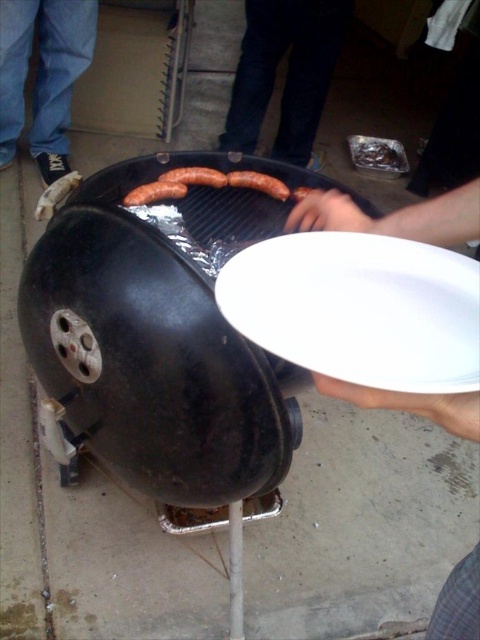
You are standing in front of the grill and want to reach two points marked in the scene. The first point is at coordinate point(38,202) and the second is at point(228,182). Which point should you reach first without moving your feet?

You should reach point(38,202) first because it is closer to you than point(228,182), which is farther away.

Looking at this image, you are a food delivery robot with a 12 inch wide tray. You need to place the white matte plate at center onto the black matte grill at center. Can your tray fit between them without touching either?

The black matte grill at center and white matte plate at center are 12.69 inches apart. Since your tray is 12 inches wide, there is enough space between them to fit the tray without touching either object.